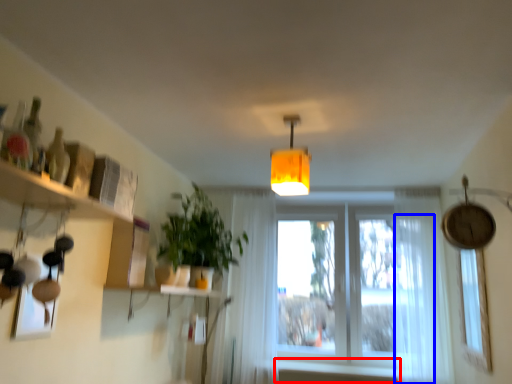
Question: Among these objects, which one is nearest to the camera, window sill (highlighted by a red box) or curtain (highlighted by a blue box)?

Choices:
 (A) window sill
 (B) curtain

Answer: (B)